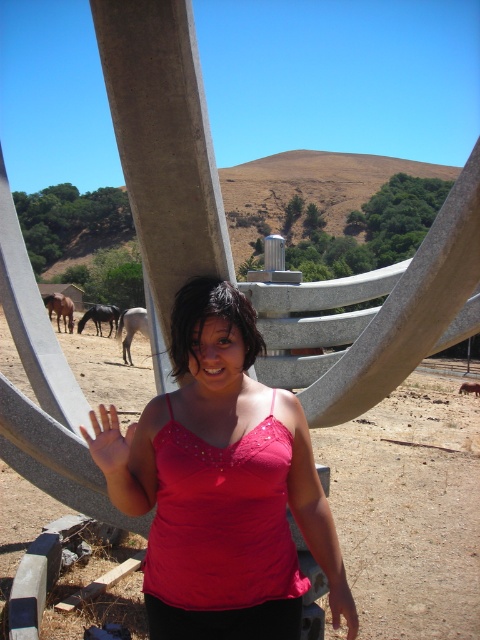
Is point (101, 321) farther from camera compared to point (474, 390)?

Yes, it is behind point (474, 390).

Does dark brown horse at center lie behind brown horse at center?

Yes, dark brown horse at center is further from the viewer.

Is point (118, 307) positioned in front of point (478, 388)?

No, it is not.

Where is `dark brown horse at center`? dark brown horse at center is located at coordinates (99, 317).

Can you confirm if dark brown horse at center is shorter than brown glossy horse at left?

Correct, dark brown horse at center is not as tall as brown glossy horse at left.

Can you confirm if dark brown horse at center is taller than brown glossy horse at left?

Incorrect, dark brown horse at center's height is not larger of brown glossy horse at left's.

Is point (110, 305) more distant than point (67, 304)?

Yes, it is behind point (67, 304).

This screenshot has width=480, height=640. What are the coordinates of `dark brown horse at center` in the screenshot? It's located at (99, 317).

From the picture: Is the position of matte pink fabric at center more distant than that of dark brown horse at center?

No.

Which is behind, point (336, 586) or point (98, 330)?

The point (98, 330) is more distant.

Where is `matte pink fabric at center`? Image resolution: width=480 pixels, height=640 pixels. matte pink fabric at center is located at coordinates (342, 604).